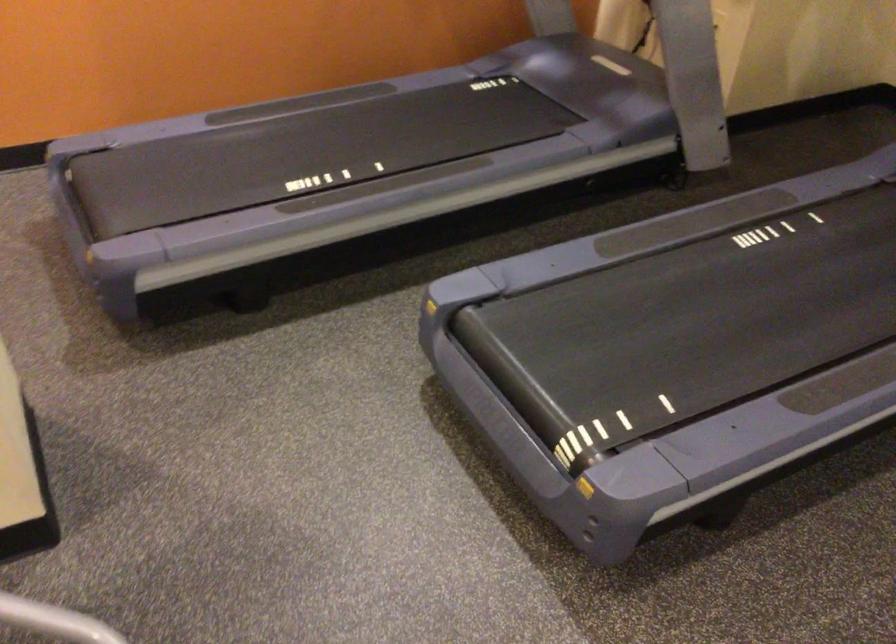
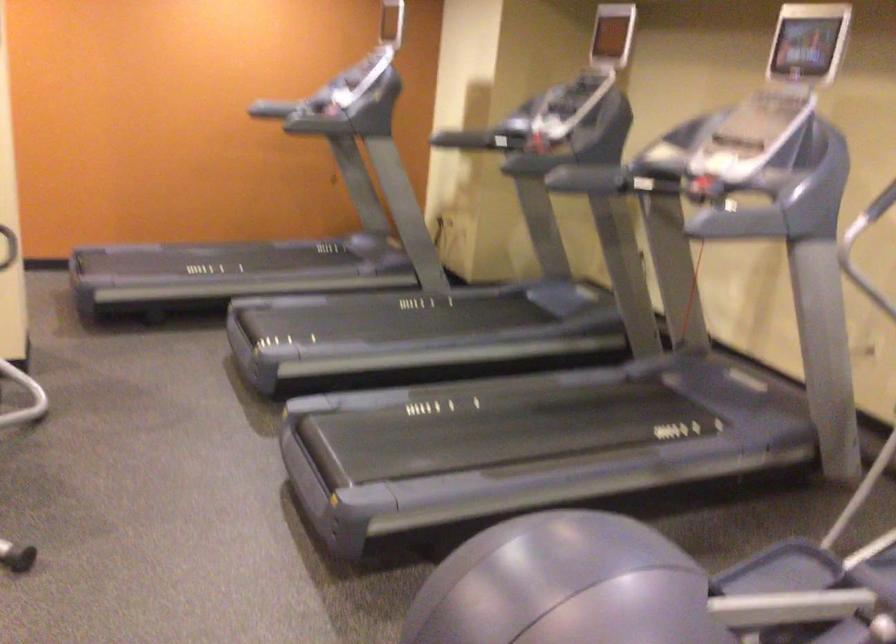
In a continuous first-person perspective shot, in which direction is the camera moving?

The cameraman walked toward right, backward.